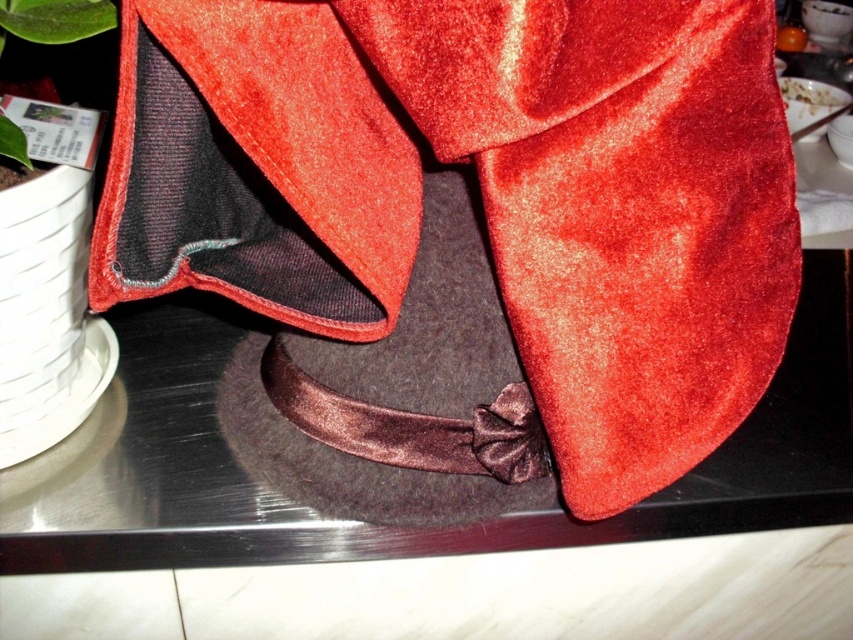
You are a costume designer preparing for a play. You have a velvet red cape at center and a green matte leaf at upper left. Which item will you choose if you need a larger accessory for a dramatic entrance?

The velvet red cape at center is bigger than the green matte leaf at upper left, so you should choose the velvet red cape at center for the dramatic entrance.

You are a tailor measuring materials for a costume. You have a velvet red cape at center and a green matte leaf at upper left. Which material has a greater width for your project?

The velvet red cape at center has a greater width than the green matte leaf at upper left according to the description.

You are a chef preparing a dessert and see the velvet red cape at center and the white creamy food at upper right on your counter. Which item is closer to the left edge of the counter?

The velvet red cape at center is positioned on the left side of white creamy food at upper right, so it is closer to the left edge of the counter.